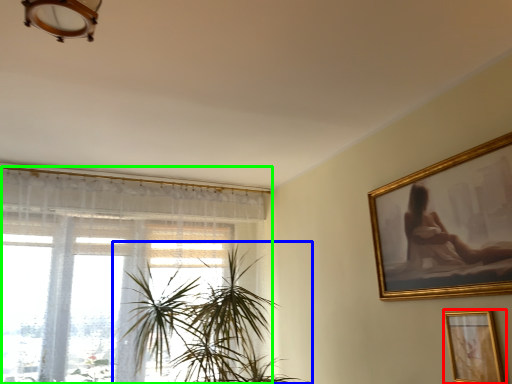
Question: Which object is the farthest from picture frame (highlighted by a red box)? Choose among these: houseplant (highlighted by a blue box) or window (highlighted by a green box).

Choices:
 (A) houseplant
 (B) window

Answer: (B)